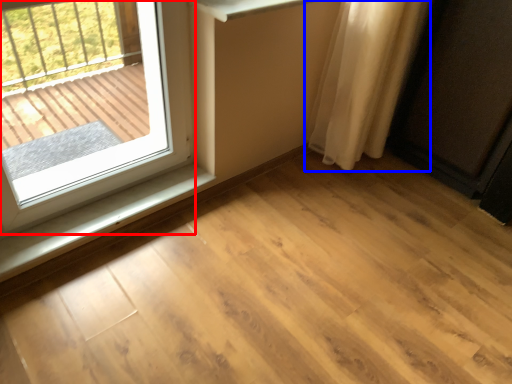
Question: Among these objects, which one is nearest to the camera, window (highlighted by a red box) or curtain (highlighted by a blue box)?

Choices:
 (A) window
 (B) curtain

Answer: (A)